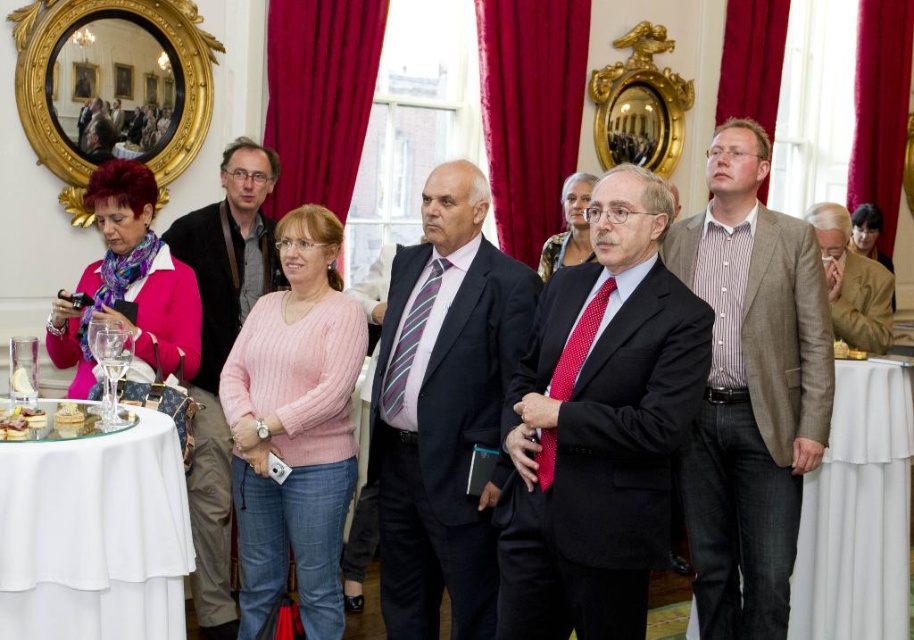
You are a photographer standing at the center of the room. You want to take a photo of the white cloth at lower right and the brown leather jacket at right. Can you capture both in a single frame without moving your camera? Explain why or why not based on their distance.

The white cloth at lower right is 28.20 inches away from the brown leather jacket at right. Since the distance between them is relatively small, it is likely possible to capture both in a single frame without moving the camera, provided the camera has an appropriate lens and zoom level.

You are attending a formal event and notice two individuals dressed in black attire. You see the matte black suit at center and the matte black jacket at center. Which one is positioned lower in the image?

The matte black suit at center is located below the matte black jacket at center, so the matte black suit at center is positioned lower in the image.

You are an event planner arranging a photo shoot in the described scene. You need to position a backdrop to the left of the golden textured bread at lower left. Will the striped cotton shirt at center be visible in the photo if the backdrop is placed there?

The striped cotton shirt at center is to the right of the golden textured bread at lower left. Placing the backdrop to the left of the bread would mean the shirt is still to the right of the backdrop, so it would remain visible in the photo.